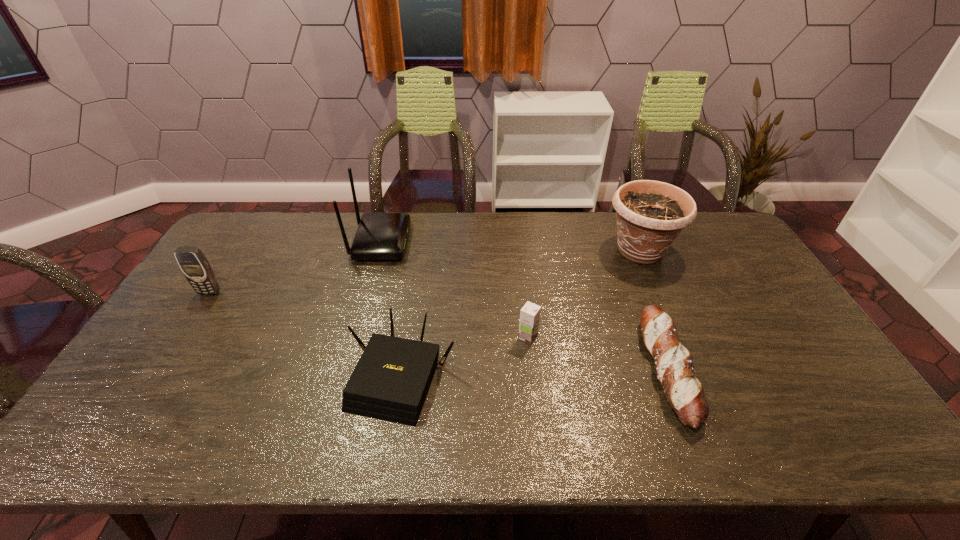
Find the location of a particular element. vacant area that lies between the chocolate milk and the leftmost object is located at coordinates (x=369, y=315).

Identify the location of free spot between the third object from right to left and the shortest object. This screenshot has width=960, height=540. (597, 354).

Image resolution: width=960 pixels, height=540 pixels. In order to click on object that is the second nearest to the shortest object in this screenshot , I will do `click(530, 313)`.

Identify which object is located as the third nearest to the cellular telephone. Please provide its 2D coordinates. Your answer should be formatted as a tuple, i.e. [(x, y)], where the tuple contains the x and y coordinates of a point satisfying the conditions above.

[(530, 313)]

What are the coordinates of `vacant space that satisfies the following two spatial constraints: 1. on the front face of the shortest object; 2. on the left side of the third tallest object` in the screenshot? It's located at (159, 370).

Find the location of a particular element. free space that satisfies the following two spatial constraints: 1. on the back side of the flowerpot; 2. on the front-facing side of the taller router is located at coordinates (636, 241).

Locate an element on the screen. The width and height of the screenshot is (960, 540). free space that satisfies the following two spatial constraints: 1. on the front face of the third tallest object; 2. on the left side of the shortest object is located at coordinates (159, 370).

You are a GUI agent. You are given a task and a screenshot of the screen. Output one action in this format:
    pyautogui.click(x=<x>, y=<y>)
    Task: Click on the vacant area in the image that satisfies the following two spatial constraints: 1. on the front-facing side of the taller router; 2. on the front face of the fourth nearest object
    The height and width of the screenshot is (540, 960).
    Given the screenshot: What is the action you would take?
    pyautogui.click(x=367, y=292)

At what (x,y) coordinates should I click in order to perform the action: click on vacant space that satisfies the following two spatial constraints: 1. on the front face of the shortest object; 2. on the right side of the third tallest object. Please return your answer as a coordinate pair (x, y). The height and width of the screenshot is (540, 960). Looking at the image, I should click on (159, 370).

Where is `vacant space that satisfies the following two spatial constraints: 1. on the front-facing side of the taller router; 2. on the front face of the third farthest object`? vacant space that satisfies the following two spatial constraints: 1. on the front-facing side of the taller router; 2. on the front face of the third farthest object is located at coordinates (367, 292).